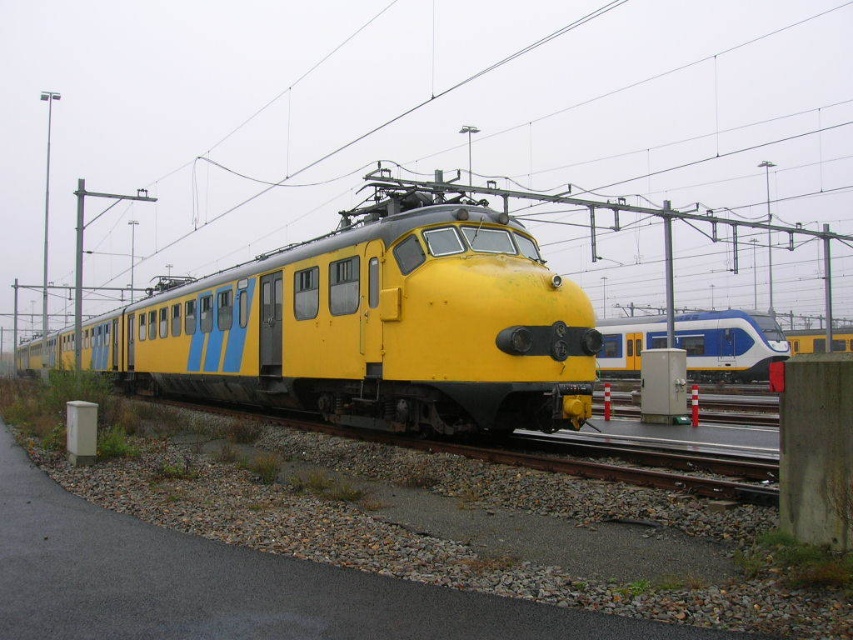
Consider the image. You are a railway engineer assessing the space between two tracks. You see the yellow matte train at center and the blue glossy train at right. Which train occupies more space on the tracks?

Answer: The yellow matte train at center has a larger size compared to the blue glossy train at right, so it occupies more space on the tracks.